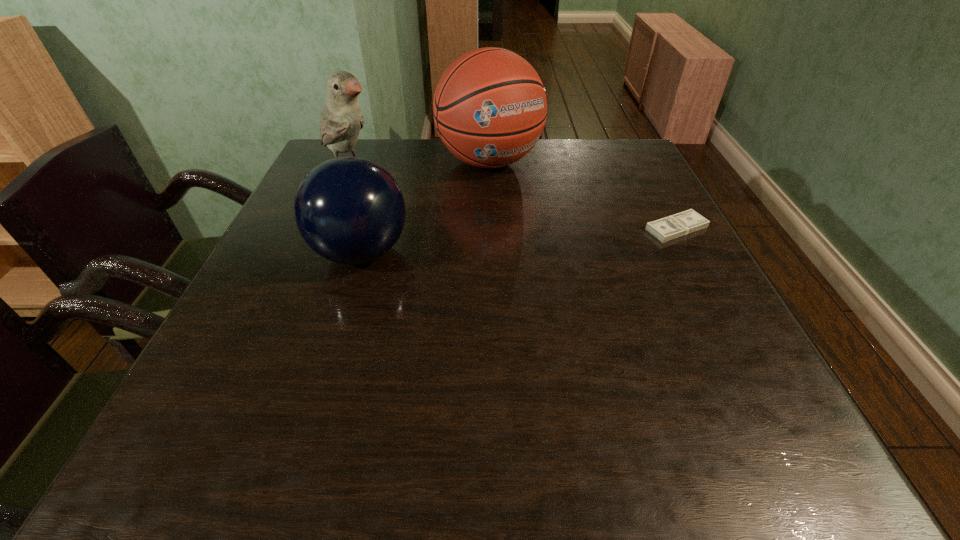
Find the location of `free point located 0.400m at the face of the bird`. free point located 0.400m at the face of the bird is located at coordinates (479, 238).

This screenshot has width=960, height=540. Find the location of `vacant point located 0.140m at the face of the bird`. vacant point located 0.140m at the face of the bird is located at coordinates (404, 197).

You are a GUI agent. You are given a task and a screenshot of the screen. Output one action in this format:
    pyautogui.click(x=<x>, y=<y>)
    Task: Click on the free region located at the face of the bird
    This screenshot has width=960, height=540.
    Given the screenshot: What is the action you would take?
    pyautogui.click(x=431, y=212)

Locate an element on the screen. Image resolution: width=960 pixels, height=540 pixels. basketball at the far edge is located at coordinates (490, 106).

What are the coordinates of `bird at the far edge` in the screenshot? It's located at (341, 122).

Find the location of `bowling ball present at the left edge`. bowling ball present at the left edge is located at coordinates (349, 210).

I want to click on bird situated at the left edge, so pyautogui.click(x=341, y=122).

The height and width of the screenshot is (540, 960). Find the location of `object present at the right edge`. object present at the right edge is located at coordinates (683, 223).

Identify the location of object that is at the far left corner. (341, 122).

Locate an element on the screen. This screenshot has width=960, height=540. vacant space at the far edge is located at coordinates (399, 163).